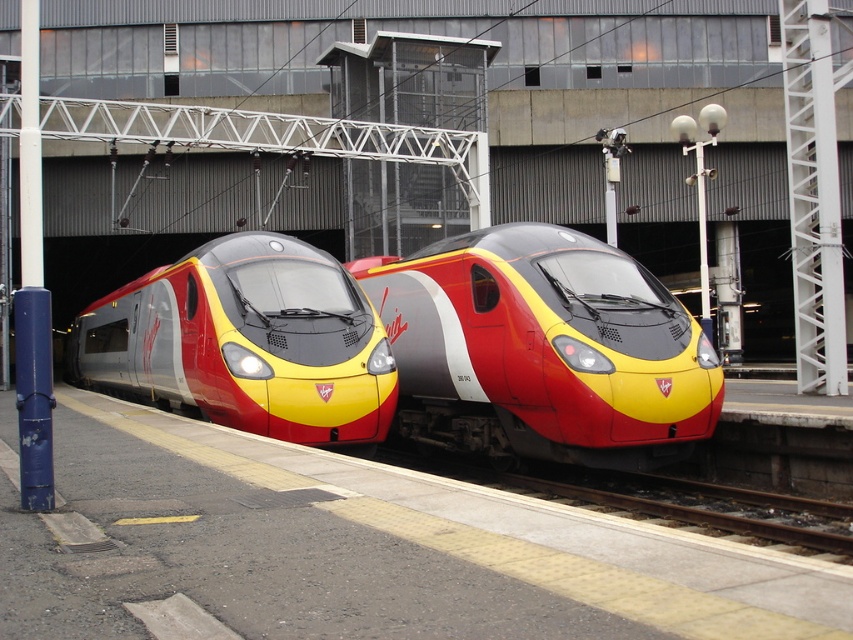
Can you confirm if matte red and yellow train at center is thinner than matte metallic train at center?

Correct, matte red and yellow train at center's width is less than matte metallic train at center's.

At what (x,y) coordinates should I click in order to perform the action: click on matte red and yellow train at center. Please return your answer as a coordinate pair (x, y). Looking at the image, I should click on (543, 349).